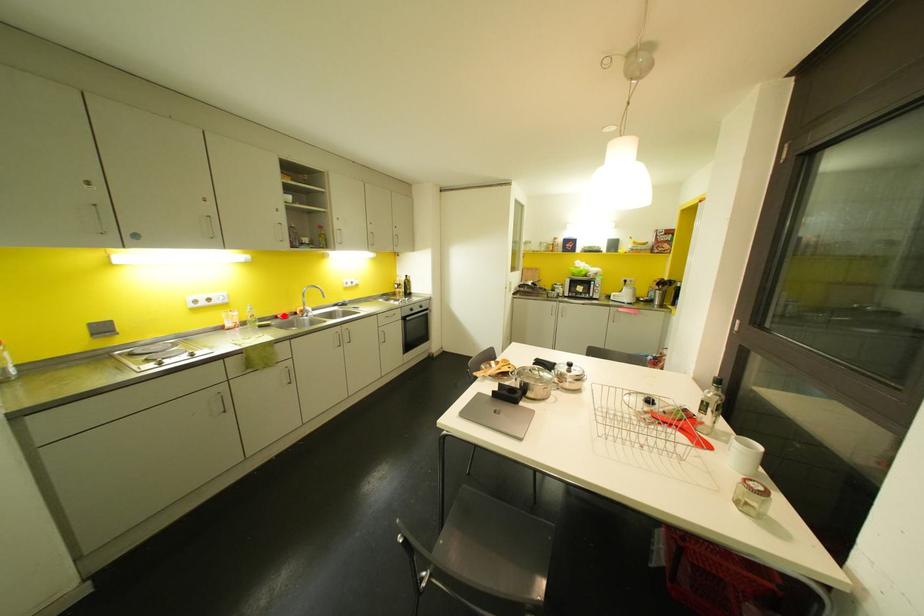
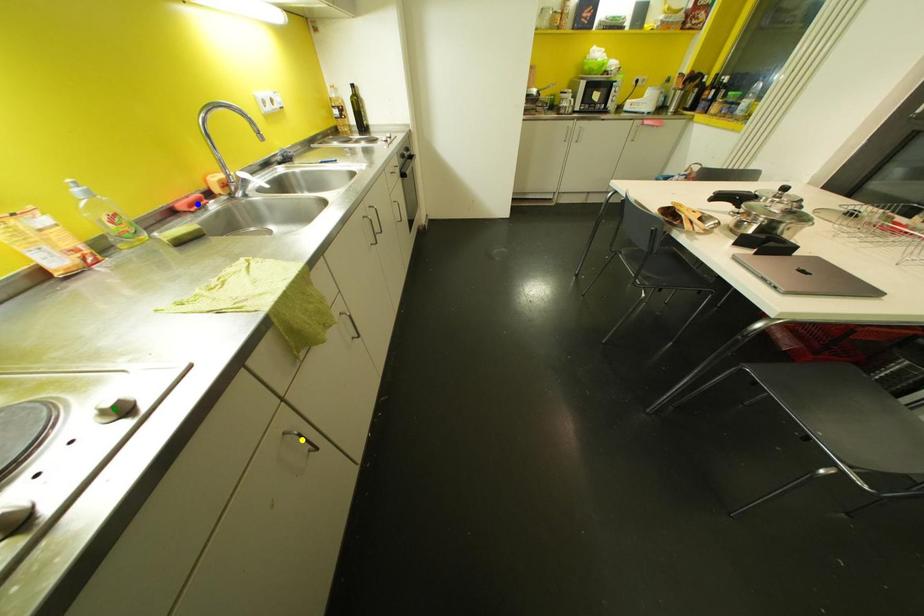
Question: I am providing you with two images of the same scene from different viewpoints. A red point is marked on the first image. You are given multiple points on the second image. Can you choose the point in image 2 that corresponds to the point in image 1?

Choices:
 (A) green point
 (B) blue point
 (C) yellow point

Answer: (B)